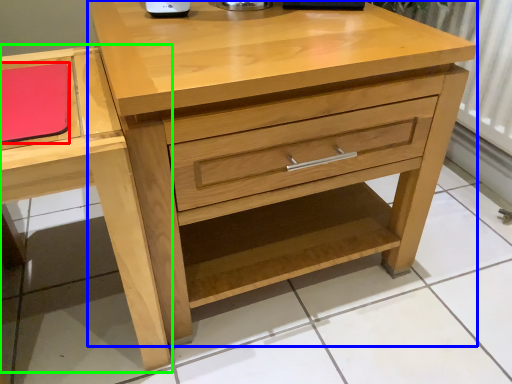
Question: Considering the real-world distances, which object is closest to notepad (highlighted by a red box)? chest of drawers (highlighted by a blue box) or vanity (highlighted by a green box).

Choices:
 (A) chest of drawers
 (B) vanity

Answer: (B)